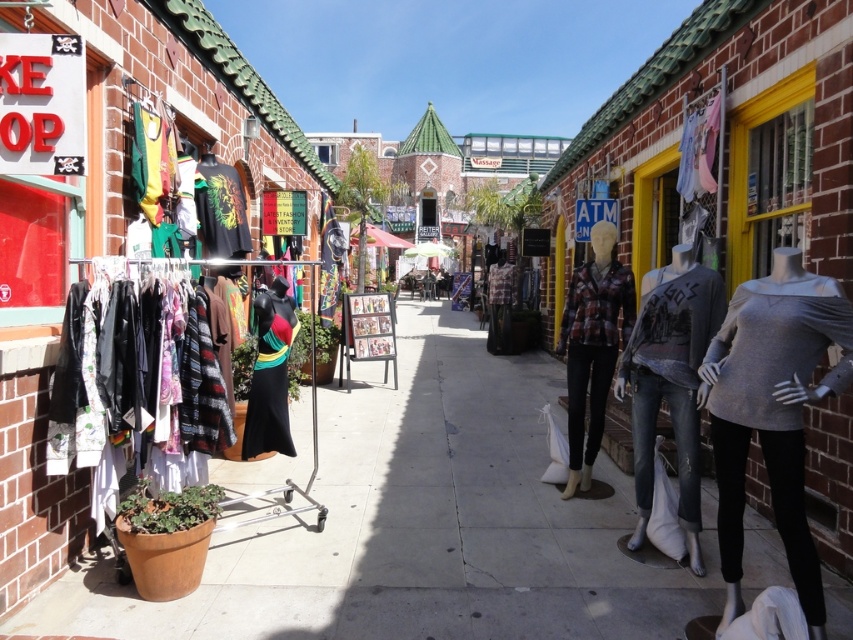
Can you confirm if smooth concrete pavement at center is positioned to the left of denim jeans at center?

Yes, smooth concrete pavement at center is to the left of denim jeans at center.

Between point (326, 493) and point (646, 474), which one is positioned in front?

Point (646, 474)

Identify the location of smooth concrete pavement at center. (419, 524).

Find the location of `smooth concrete pavement at center`. smooth concrete pavement at center is located at coordinates (419, 524).

Does smooth concrete pavement at center have a lesser width compared to black matte dress at center?

Incorrect, smooth concrete pavement at center's width is not less than black matte dress at center's.

In the scene shown: Can you confirm if smooth concrete pavement at center is wider than black matte dress at center?

Indeed, smooth concrete pavement at center has a greater width compared to black matte dress at center.

Is point (515, 621) positioned in front of point (267, 348)?

Yes, point (515, 621) is in front of point (267, 348).

Image resolution: width=853 pixels, height=640 pixels. I want to click on smooth concrete pavement at center, so click(x=419, y=524).

Is gray matte sweater at center-right closer to camera compared to black matte dress at center?

Yes, gray matte sweater at center-right is in front of black matte dress at center.

Does gray matte sweater at center-right come behind black matte dress at center?

No, it is in front of black matte dress at center.

What do you see at coordinates (772, 413) in the screenshot? I see `gray matte sweater at center-right` at bounding box center [772, 413].

The height and width of the screenshot is (640, 853). Find the location of `gray matte sweater at center-right`. gray matte sweater at center-right is located at coordinates (772, 413).